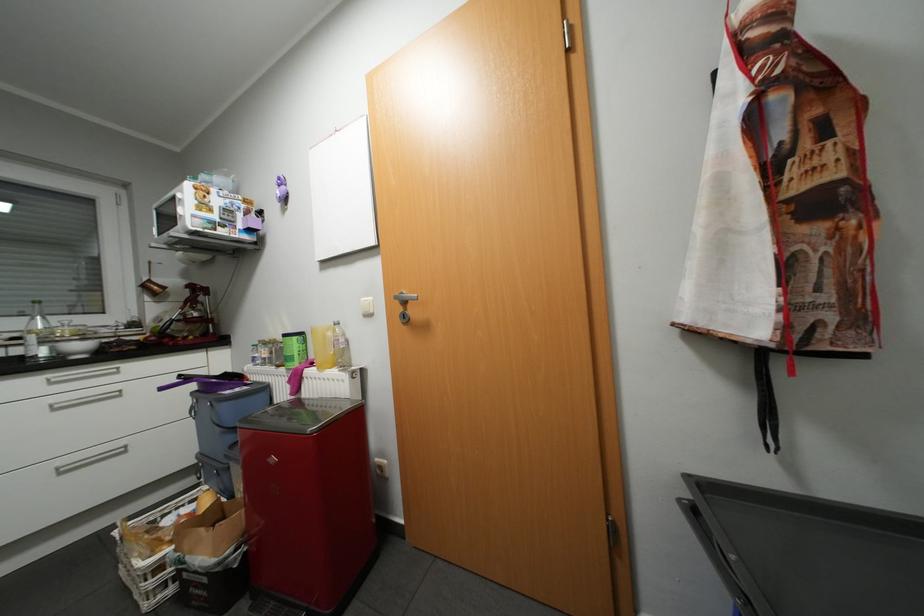
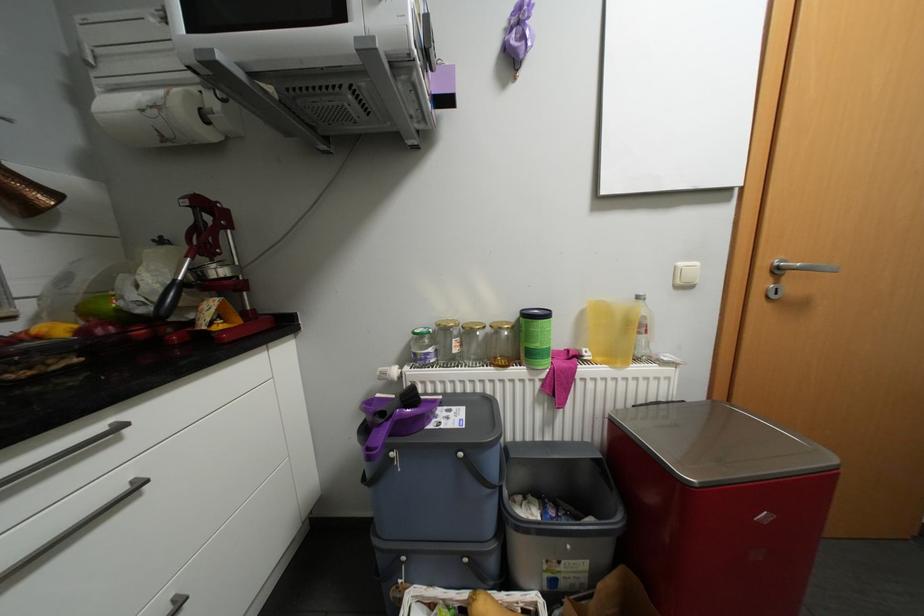
The images are taken continuously from a first-person perspective. In which direction are you moving?

The cameraman moved toward left, forward.